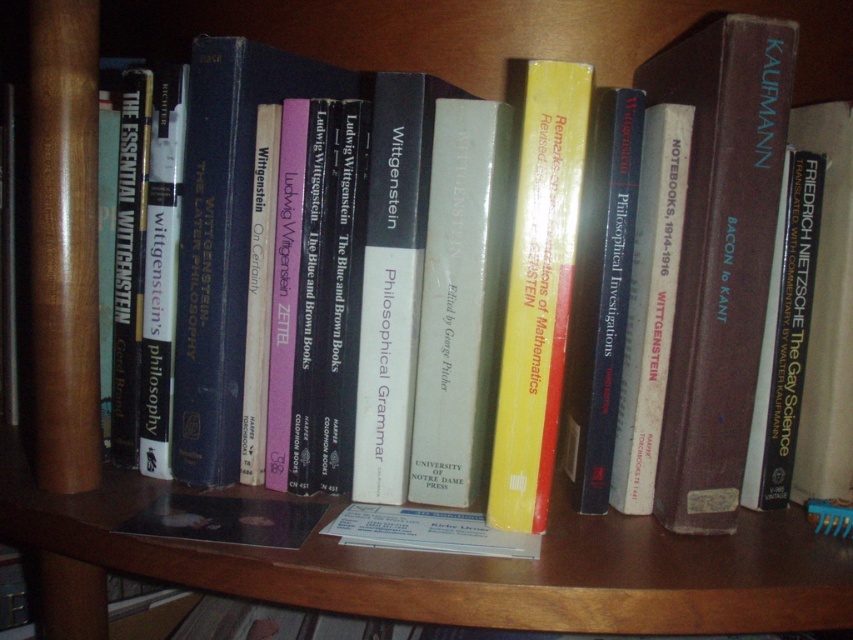
You are organizing a bookshelf and want to place a new book between the brown leather book at center and the yellow matte book at center. However, you notice a spatial constraint. Can you determine which book is on top to know where to insert the new book?

The brown leather book at center is positioned over the yellow matte book at center, so the new book should be placed below the brown leather book at center or above the yellow matte book at center to maintain the existing order.

You are organizing a bookshelf and have two books to place side by side. You have a brown leather book at center and a yellow matte book at center. If you want to arrange them so that the wider book is on the left, which book should you place on the left?

The brown leather book at center is wider than the yellow matte book at center, so you should place the brown leather book at center on the left to have the wider book there.